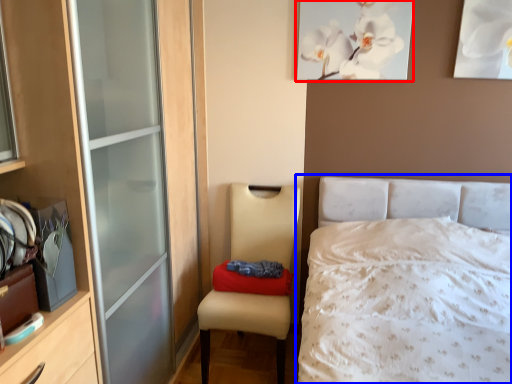
Question: Which object is further to the camera taking this photo, picture frame (highlighted by a red box) or bed (highlighted by a blue box)?

Choices:
 (A) picture frame
 (B) bed

Answer: (A)